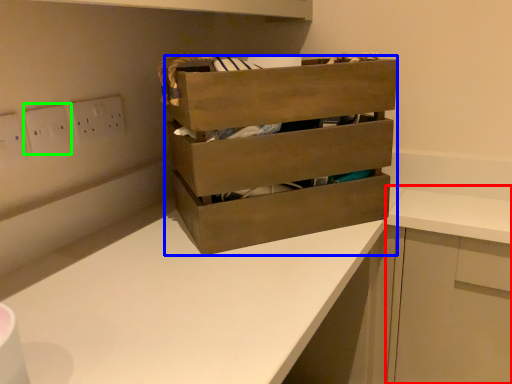
Question: Which object is positioned farthest from cabinetry (highlighted by a red box)? Select from chest of drawers (highlighted by a blue box) and electric outlet (highlighted by a green box).

Choices:
 (A) chest of drawers
 (B) electric outlet

Answer: (B)